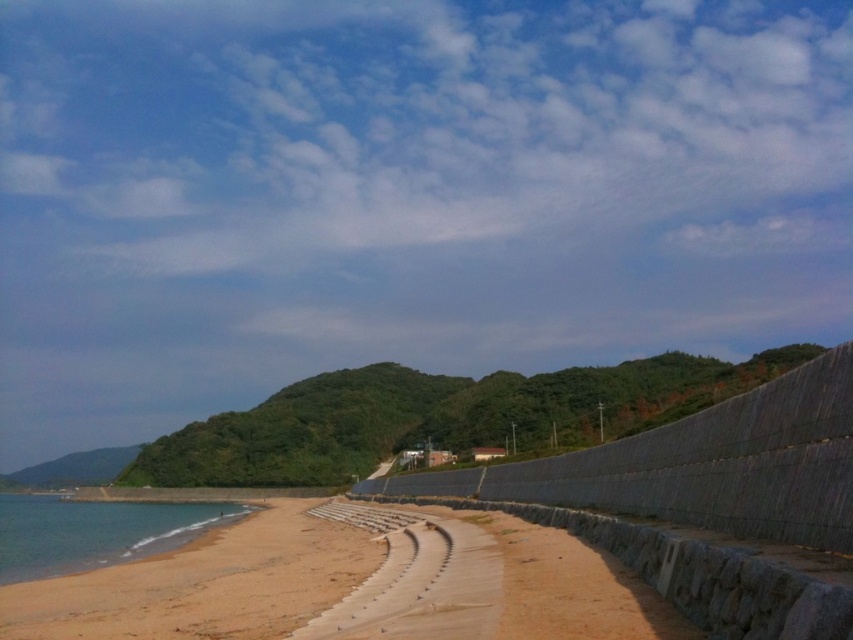
In the scene shown: You are standing on the beach and want to take a photo of both the gray concrete wall at center and the clear blue water at lower left. Which object should you focus on first to ensure both are in sharp focus?

You should focus on the gray concrete wall at center first because it is closer to the viewer than the clear blue water at lower left, so adjusting focus from near to far will help both be in sharp focus.

You are a coastal engineer assessing erosion risks. You observe the gray concrete wall at center and the clear blue water at lower left. Which structure has a lower height in this coastal scene?

The gray concrete wall at center has a lesser height compared to the clear blue water at lower left, so the gray concrete wall at center is shorter in height.